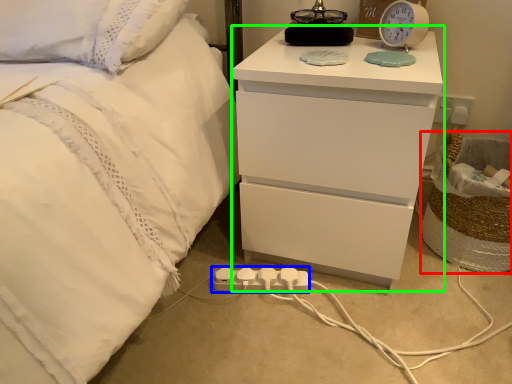
Question: Based on their relative distances, which object is farther from laundry basket (highlighted by a red box)? Choose from extension cord (highlighted by a blue box) and nightstand (highlighted by a green box).

Choices:
 (A) extension cord
 (B) nightstand

Answer: (A)